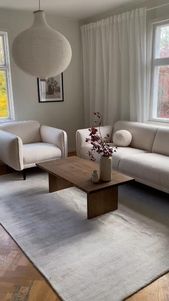
This screenshot has height=301, width=169. In order to click on window behind sofa in this screenshot , I will do `click(164, 105)`.